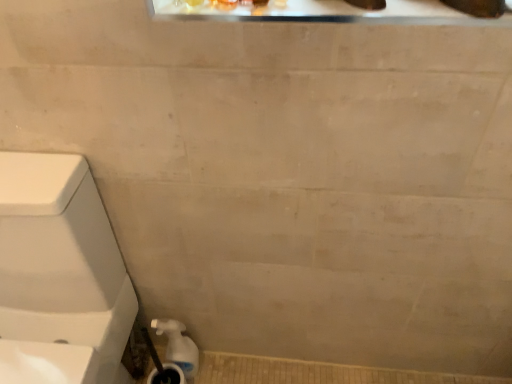
Image resolution: width=512 pixels, height=384 pixels. What are the coordinates of `white glossy water pipe at lower left` in the screenshot? It's located at (178, 346).

Describe the element at coordinates (178, 346) in the screenshot. I see `white glossy water pipe at lower left` at that location.

This screenshot has width=512, height=384. Find the location of `white glossy toilet at left`. white glossy toilet at left is located at coordinates (59, 275).

Describe the element at coordinates (59, 275) in the screenshot. This screenshot has width=512, height=384. I see `white glossy toilet at left` at that location.

The height and width of the screenshot is (384, 512). Identify the location of white glossy water pipe at lower left. (178, 346).

Is white glossy toilet at left at the left side of white glossy water pipe at lower left?

Correct, you'll find white glossy toilet at left to the left of white glossy water pipe at lower left.

Which object is more forward, white glossy toilet at left or white glossy water pipe at lower left?

white glossy toilet at left is in front.

Is point (17, 235) closer to camera compared to point (176, 353)?

Yes, it is in front of point (176, 353).

From the image's perspective, which object appears higher, white glossy toilet at left or white glossy water pipe at lower left?

white glossy toilet at left is shown above in the image.

From a real-world perspective, is white glossy toilet at left over white glossy water pipe at lower left?

Yes.

Between white glossy toilet at left and white glossy water pipe at lower left, which one has smaller width?

With smaller width is white glossy water pipe at lower left.

In the scene shown: Does white glossy toilet at left have a greater height compared to white glossy water pipe at lower left?

Correct, white glossy toilet at left is much taller as white glossy water pipe at lower left.

In terms of size, does white glossy toilet at left appear bigger or smaller than white glossy water pipe at lower left?

white glossy toilet at left is bigger than white glossy water pipe at lower left.

Would you say white glossy water pipe at lower left is part of white glossy toilet at left's contents?

That's incorrect, white glossy water pipe at lower left is not inside white glossy toilet at left.

From the picture: Can you see white glossy toilet at left touching white glossy water pipe at lower left?

No, white glossy toilet at left is not with white glossy water pipe at lower left.

Is white glossy water pipe at lower left at the back of white glossy toilet at left?

white glossy toilet at left does not have its back to white glossy water pipe at lower left.

From the picture: Measure the distance from white glossy toilet at left to white glossy water pipe at lower left.

white glossy toilet at left and white glossy water pipe at lower left are 13.83 inches apart.

The height and width of the screenshot is (384, 512). Identify the location of water pipe below the white glossy toilet at left (from a real-world perspective). (178, 346).

Considering the positions of objects white glossy water pipe at lower left and white glossy toilet at left in the image provided, who is more to the right, white glossy water pipe at lower left or white glossy toilet at left?

From the viewer's perspective, white glossy water pipe at lower left appears more on the right side.

Is the position of white glossy water pipe at lower left more distant than that of white glossy toilet at left?

Yes.

Does point (155, 328) come in front of point (24, 345)?

No.

From the image's perspective, is white glossy water pipe at lower left over white glossy toilet at left?

No, from the image's perspective, white glossy water pipe at lower left is not over white glossy toilet at left.

From a real-world perspective, is white glossy water pipe at lower left positioned over white glossy toilet at left based on gravity?

No, from a real-world perspective, white glossy water pipe at lower left is not above white glossy toilet at left.

Which of these two, white glossy water pipe at lower left or white glossy toilet at left, is wider?

white glossy toilet at left is wider.

Considering the sizes of objects white glossy water pipe at lower left and white glossy toilet at left in the image provided, who is shorter, white glossy water pipe at lower left or white glossy toilet at left?

white glossy water pipe at lower left.

Looking at the image, does white glossy water pipe at lower left seem bigger or smaller compared to white glossy toilet at left?

Clearly, white glossy water pipe at lower left is smaller in size than white glossy toilet at left.

Would you say white glossy toilet at left is part of white glossy water pipe at lower left's contents?

No, white glossy toilet at left is not inside white glossy water pipe at lower left.

Is white glossy water pipe at lower left far from white glossy toilet at left?

No, white glossy water pipe at lower left is not far from white glossy toilet at left.

Is white glossy toilet at left at the back of white glossy water pipe at lower left?

No, white glossy water pipe at lower left is not facing the opposite direction of white glossy toilet at left.

How much distance is there between white glossy water pipe at lower left and white glossy toilet at left?

white glossy water pipe at lower left and white glossy toilet at left are 13.83 inches apart from each other.

The height and width of the screenshot is (384, 512). What are the coordinates of `toilet lying on the left of white glossy water pipe at lower left` in the screenshot? It's located at (59, 275).

The width and height of the screenshot is (512, 384). I want to click on toilet above the white glossy water pipe at lower left (from a real-world perspective), so click(59, 275).

This screenshot has width=512, height=384. What are the coordinates of `water pipe below the white glossy toilet at left (from the image's perspective)` in the screenshot? It's located at (178, 346).